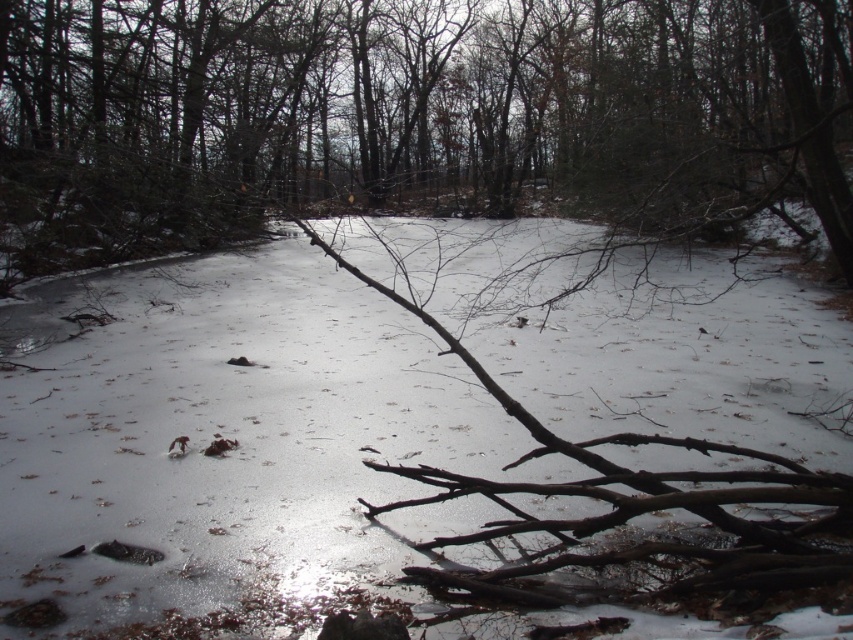
Question: Which object is farther from the camera taking this photo?

Choices:
 (A) white matte snow at center
 (B) brown rough branch at center

Answer: (B)

Question: Which point is closer to the camera?

Choices:
 (A) brown rough branch at center
 (B) white matte snow at center

Answer: (B)

Question: Does white matte snow at center have a smaller size compared to brown rough branch at center?

Choices:
 (A) yes
 (B) no

Answer: (A)

Question: Is white matte snow at center behind brown rough branch at center?

Choices:
 (A) yes
 (B) no

Answer: (B)

Question: Is white matte snow at center bigger than brown rough branch at center?

Choices:
 (A) yes
 (B) no

Answer: (B)

Question: Among these points, which one is nearest to the camera?

Choices:
 (A) (38, 522)
 (B) (572, 16)

Answer: (A)